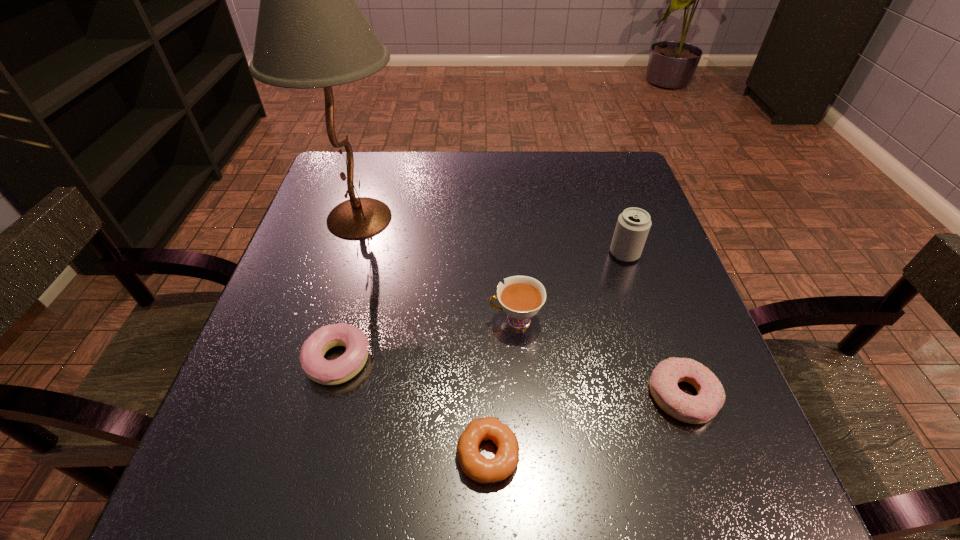
Find the location of `object at the far left corner`. object at the far left corner is located at coordinates (311, 33).

In the image, there is a desktop. Where is `free space at the far edge`? The width and height of the screenshot is (960, 540). free space at the far edge is located at coordinates (550, 163).

The image size is (960, 540). In the image, there is a desktop. Find the location of `free space at the near edge`. free space at the near edge is located at coordinates (410, 456).

In the image, there is a desktop. At what (x,y) coordinates should I click in order to perform the action: click on vacant space at the left edge. Please return your answer as a coordinate pair (x, y). This screenshot has height=540, width=960. Looking at the image, I should click on (314, 221).

In the image, there is a desktop. Identify the location of free space at the right edge. (636, 369).

This screenshot has width=960, height=540. In the image, there is a desktop. Find the location of `vacant space at the near left corner`. vacant space at the near left corner is located at coordinates (237, 506).

Locate an element on the screen. free space at the far right corner is located at coordinates (636, 198).

Locate an element on the screen. Image resolution: width=960 pixels, height=540 pixels. free space between the can and the rightmost doughnut is located at coordinates (654, 325).

You are a GUI agent. You are given a task and a screenshot of the screen. Output one action in this format:
    pyautogui.click(x=<x>, y=<y>)
    Task: Click on the free space between the third tallest object and the can
    
    Given the screenshot: What is the action you would take?
    pyautogui.click(x=570, y=287)

You are a GUI agent. You are given a task and a screenshot of the screen. Output one action in this format:
    pyautogui.click(x=<x>, y=<y>)
    Task: Click on the free point between the leftmost doughnut and the second doughnut from left to right
    
    Given the screenshot: What is the action you would take?
    pyautogui.click(x=413, y=408)